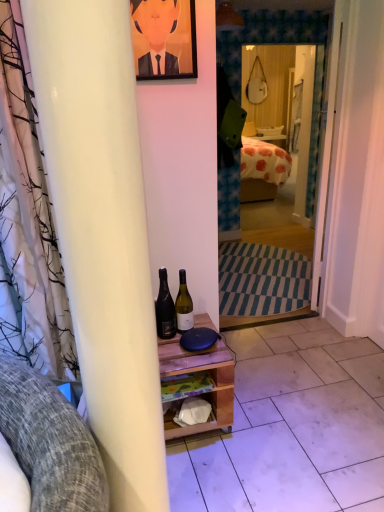
You are a GUI agent. You are given a task and a screenshot of the screen. Output one action in this format:
    pyautogui.click(x=<x>, y=<y>)
    Task: Click on the vacant space to the left of white tile at lower right, which is the first tile from right to left
    
    Given the screenshot: What is the action you would take?
    pyautogui.click(x=314, y=377)